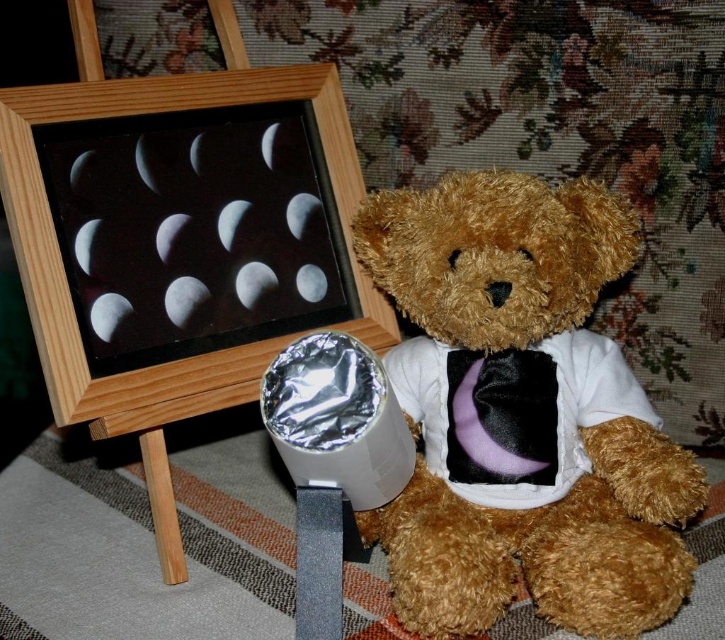
Question: Does wooden picture frame at left appear on the left side of purple velvet tie at center?

Choices:
 (A) no
 (B) yes

Answer: (B)

Question: Which of the following is the farthest from the observer?

Choices:
 (A) purple velvet tie at center
 (B) wooden picture frame at left

Answer: (A)

Question: Which object is positioned closest to the purple velvet tie at center?

Choices:
 (A) wooden picture frame at left
 (B) fuzzy brown teddy bear at center

Answer: (B)

Question: Does wooden picture frame at left appear on the right side of purple velvet tie at center?

Choices:
 (A) yes
 (B) no

Answer: (B)

Question: Considering the real-world distances, which object is closest to the fuzzy brown teddy bear at center?

Choices:
 (A) wooden picture frame at left
 (B) purple velvet tie at center

Answer: (B)

Question: Is fuzzy brown teddy bear at center bigger than wooden picture frame at left?

Choices:
 (A) yes
 (B) no

Answer: (B)